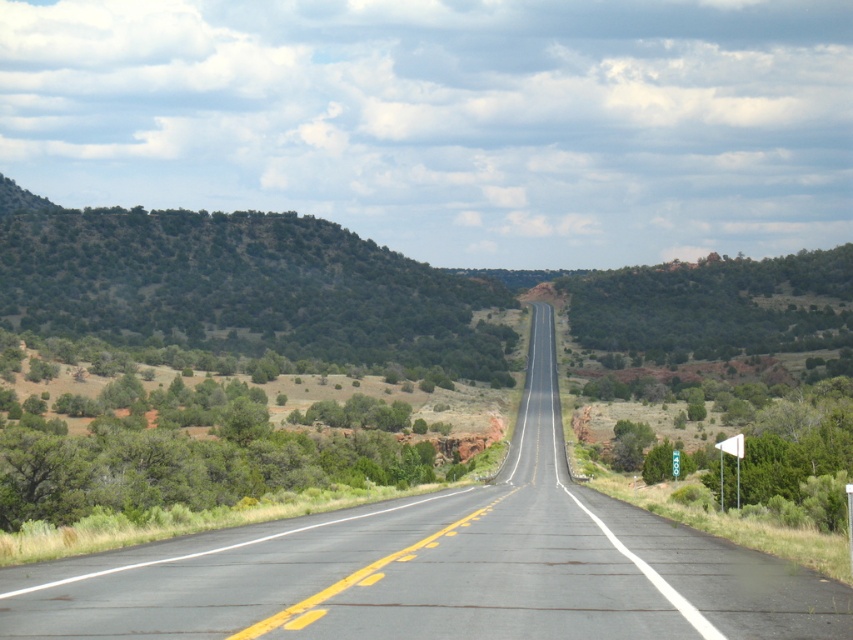
Question: Is asphalt road at center above green shrubbery at left?

Choices:
 (A) yes
 (B) no

Answer: (B)

Question: Can you confirm if asphalt road at center is positioned above green shrubbery at left?

Choices:
 (A) no
 (B) yes

Answer: (A)

Question: Among these points, which one is nearest to the camera?

Choices:
 (A) (657, 524)
 (B) (111, 257)

Answer: (A)

Question: Which of the following is the farthest from the observer?

Choices:
 (A) (111, 237)
 (B) (848, 616)

Answer: (A)

Question: Does asphalt road at center have a smaller size compared to green shrubbery at left?

Choices:
 (A) yes
 (B) no

Answer: (A)

Question: Among these objects, which one is farthest from the camera?

Choices:
 (A) asphalt road at center
 (B) green shrubbery at left

Answer: (B)